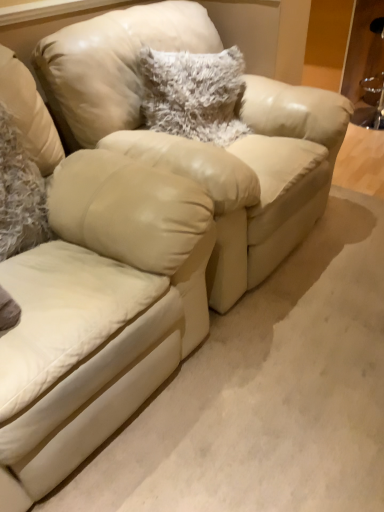
Question: Is matte leather swivel chair at center oriented away from fuzzy white pillow at left, which is the second pillow from back to front?

Choices:
 (A) no
 (B) yes

Answer: (B)

Question: Would you consider matte leather swivel chair at center to be distant from fuzzy white pillow at left, which is the 1th pillow in front-to-back order?

Choices:
 (A) yes
 (B) no

Answer: (B)

Question: Is matte leather swivel chair at center located outside fuzzy white pillow at left, the second pillow from the right?

Choices:
 (A) no
 (B) yes

Answer: (B)

Question: Are matte leather swivel chair at center and fuzzy white pillow at left, which is the second pillow from back to front, making contact?

Choices:
 (A) no
 (B) yes

Answer: (A)

Question: From a real-world perspective, does matte leather swivel chair at center stand above fuzzy white pillow at left, the second pillow from the right?

Choices:
 (A) no
 (B) yes

Answer: (A)

Question: From a real-world perspective, relative to matte leather swivel chair at center, is fuzzy white pillow at center, which is counted as the second pillow, starting from the front, vertically above or below?

Choices:
 (A) below
 (B) above

Answer: (B)

Question: Is fuzzy white pillow at center, acting as the second pillow starting from the left, wider or thinner than matte leather swivel chair at center?

Choices:
 (A) wide
 (B) thin

Answer: (B)

Question: In terms of height, does fuzzy white pillow at center, the 1th pillow from the right, look taller or shorter compared to matte leather swivel chair at center?

Choices:
 (A) short
 (B) tall

Answer: (A)

Question: In the image, is fuzzy white pillow at center, acting as the second pillow starting from the left, on the left side or the right side of matte leather swivel chair at center?

Choices:
 (A) left
 (B) right

Answer: (B)

Question: In terms of height, does fuzzy white pillow at left, positioned as the first pillow in left-to-right order, look taller or shorter compared to fuzzy white pillow at center, positioned as the first pillow in back-to-front order?

Choices:
 (A) short
 (B) tall

Answer: (B)

Question: Is fuzzy white pillow at left, the second pillow from the right, bigger or smaller than fuzzy white pillow at center, positioned as the first pillow in back-to-front order?

Choices:
 (A) big
 (B) small

Answer: (B)

Question: Is point (6, 188) positioned closer to the camera than point (218, 64)?

Choices:
 (A) closer
 (B) farther

Answer: (A)

Question: Is fuzzy white pillow at left, the second pillow from the right, spatially inside fuzzy white pillow at center, acting as the second pillow starting from the left, or outside of it?

Choices:
 (A) inside
 (B) outside

Answer: (B)

Question: Considering the positions of matte leather swivel chair at center and fuzzy white pillow at left, which is the second pillow from back to front, in the image, is matte leather swivel chair at center bigger or smaller than fuzzy white pillow at left, which is the second pillow from back to front,?

Choices:
 (A) small
 (B) big

Answer: (B)

Question: From the image's perspective, is matte leather swivel chair at center positioned above or below fuzzy white pillow at left, positioned as the first pillow in left-to-right order?

Choices:
 (A) above
 (B) below

Answer: (B)